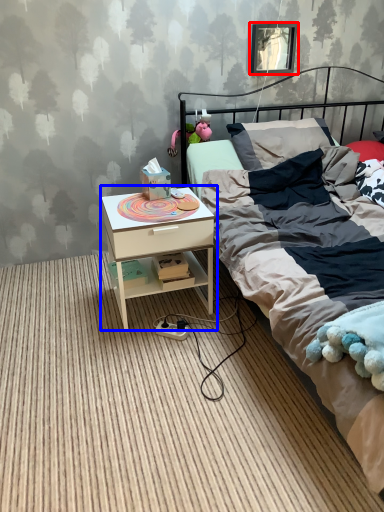
Question: Which object is further to the camera taking this photo, picture frame (highlighted by a red box) or nightstand (highlighted by a blue box)?

Choices:
 (A) picture frame
 (B) nightstand

Answer: (A)